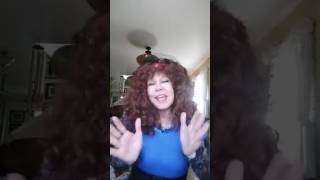
Where is `ceiling lamp`? The width and height of the screenshot is (320, 180). ceiling lamp is located at coordinates (147, 55).